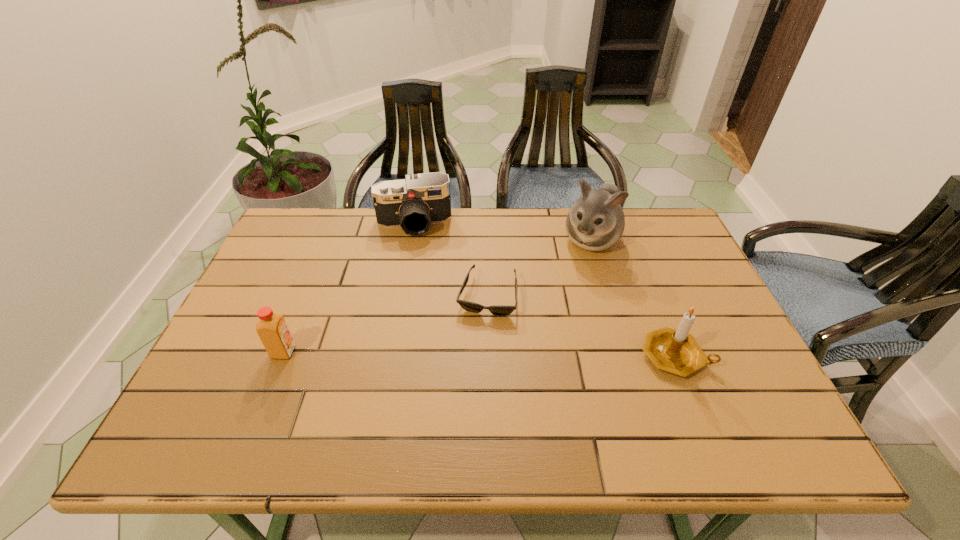
You are a GUI agent. You are given a task and a screenshot of the screen. Output one action in this format:
    pyautogui.click(x=<x>, y=<y>)
    Task: Click on the orange juice
    The height and width of the screenshot is (540, 960).
    Given the screenshot: What is the action you would take?
    pyautogui.click(x=272, y=329)

At what (x,y) coordinates should I click in order to perform the action: click on candle holder. Please return your answer as a coordinate pair (x, y). Looking at the image, I should click on (675, 351).

At what (x,y) coordinates should I click in order to perform the action: click on the tallest object. Please return your answer as a coordinate pair (x, y). Looking at the image, I should click on (596, 221).

What are the coordinates of `the third object from left to right` in the screenshot? It's located at (499, 310).

This screenshot has height=540, width=960. In order to click on the shortest object in this screenshot , I will do `click(499, 310)`.

Where is `camera`? camera is located at coordinates (414, 203).

Where is `blank space located on the front and back of the orange juice`? The image size is (960, 540). blank space located on the front and back of the orange juice is located at coordinates (x=377, y=352).

Image resolution: width=960 pixels, height=540 pixels. I want to click on free spot located on the back of the candle holder, so [632, 248].

This screenshot has height=540, width=960. Identify the location of vacant space located 0.380m on the face of the tallest object. (533, 352).

Image resolution: width=960 pixels, height=540 pixels. Find the location of `free space located 0.130m on the face of the tallest object`. free space located 0.130m on the face of the tallest object is located at coordinates (568, 287).